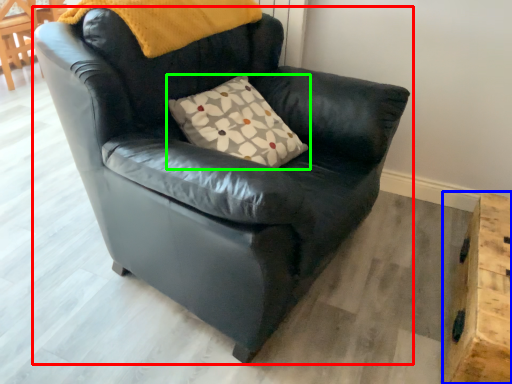
Question: Which object is positioned farthest from chair (highlighted by a red box)? Select from table (highlighted by a blue box) and pillow (highlighted by a green box).

Choices:
 (A) table
 (B) pillow

Answer: (A)